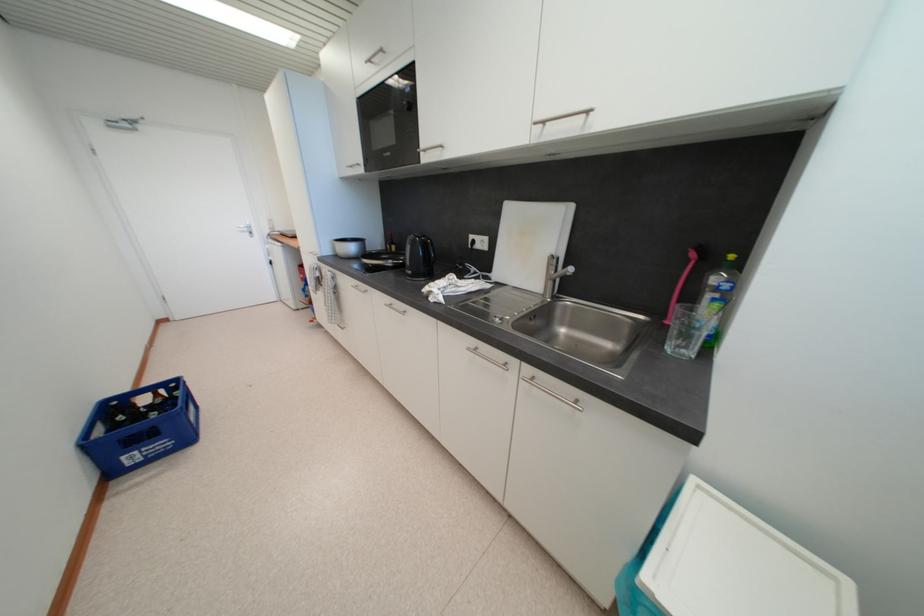
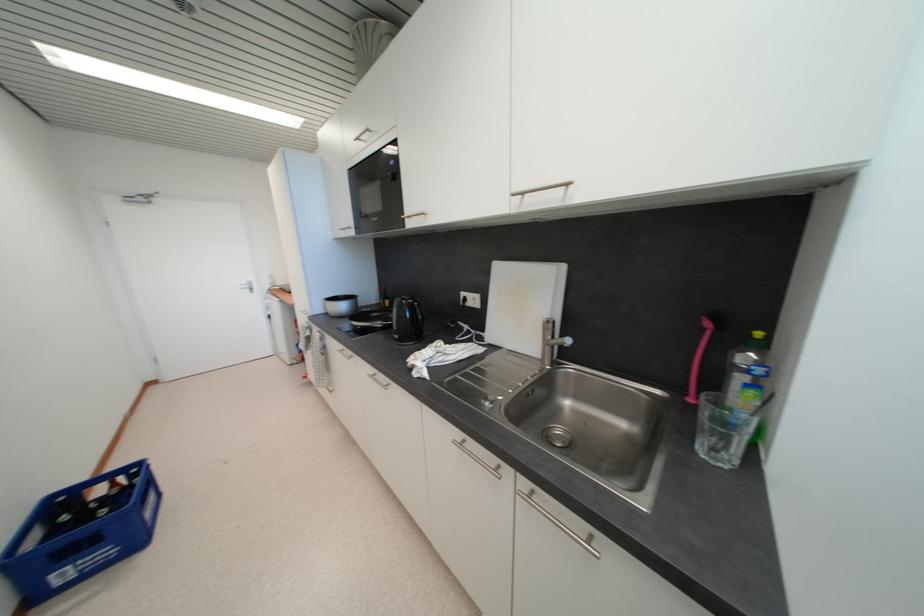
Find the pixel in the second image that matches (x=359, y=285) in the first image.

(346, 349)